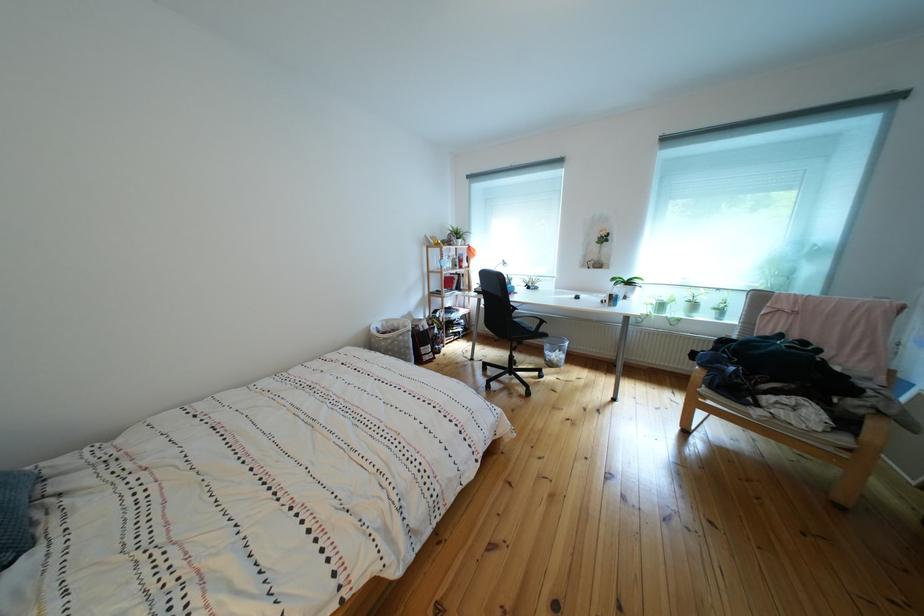
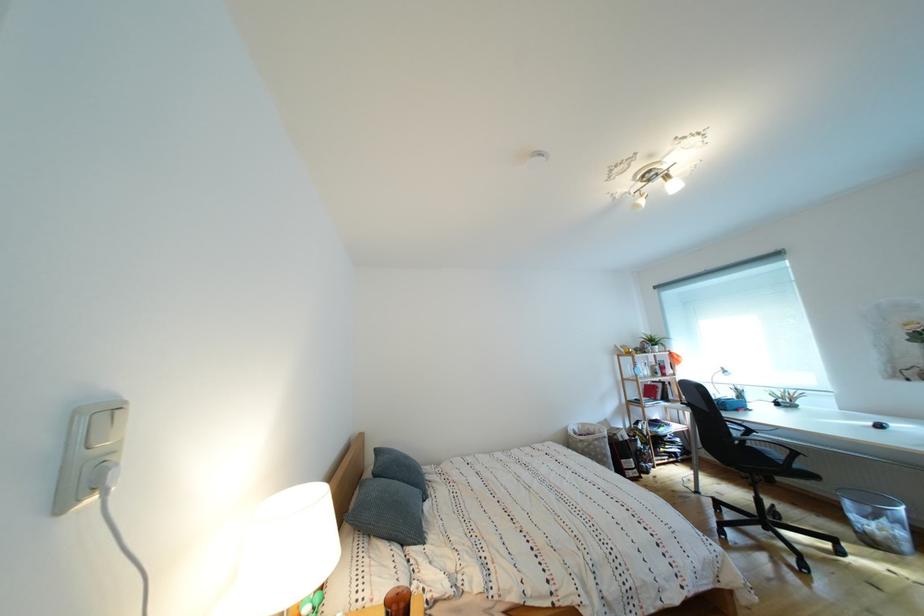
In the second image, find the point that corresponds to (x=568, y=357) in the first image.

(896, 527)